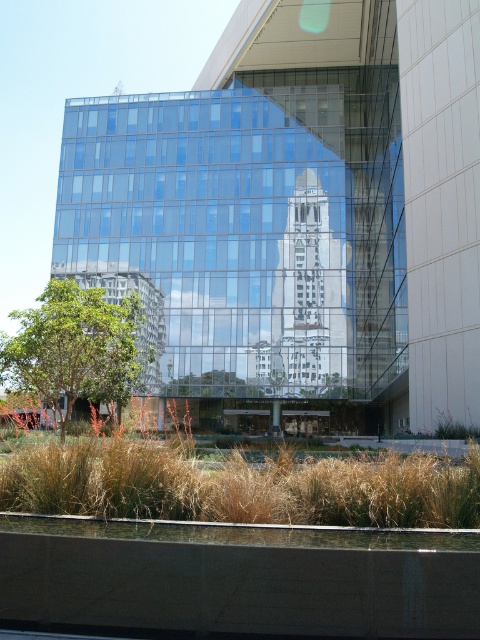
Question: Which object appears closest to the camera in this image?

Choices:
 (A) brown dry grass at lower center
 (B) transparent glass building at center

Answer: (A)

Question: Which object is farther from the camera taking this photo?

Choices:
 (A) transparent glass building at center
 (B) brown dry grass at lower center

Answer: (A)

Question: Is transparent glass building at center above brown dry grass at lower center?

Choices:
 (A) yes
 (B) no

Answer: (A)

Question: Which object is closer to the camera taking this photo?

Choices:
 (A) brown dry grass at lower center
 (B) transparent glass building at center

Answer: (A)

Question: Is transparent glass building at center bigger than brown dry grass at lower center?

Choices:
 (A) no
 (B) yes

Answer: (B)

Question: Is transparent glass building at center positioned in front of brown dry grass at lower center?

Choices:
 (A) no
 (B) yes

Answer: (A)